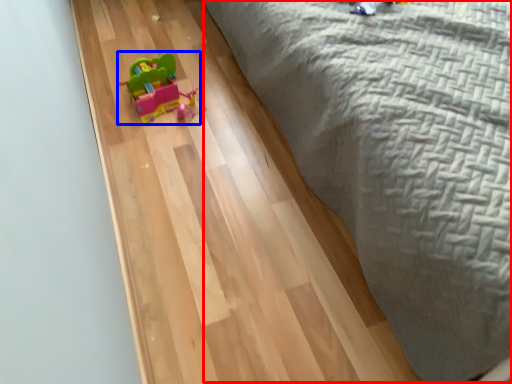
Question: Which object is further to the camera taking this photo, bed (highlighted by a red box) or toy (highlighted by a blue box)?

Choices:
 (A) bed
 (B) toy

Answer: (B)